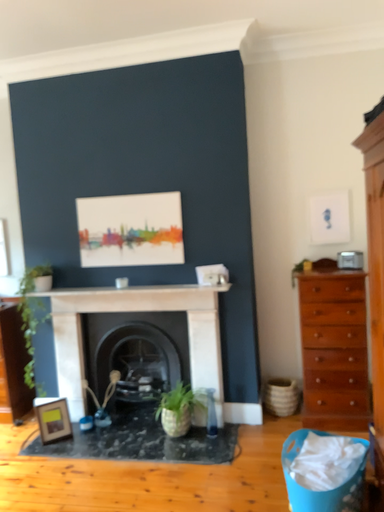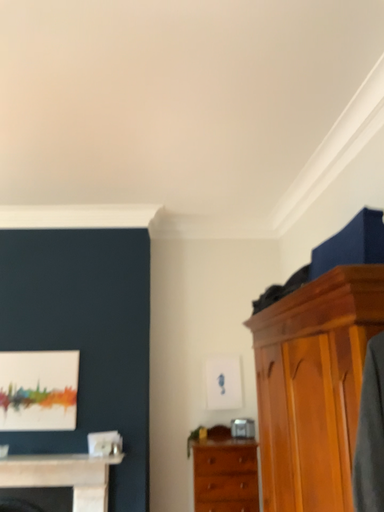
Question: Which way did the camera rotate in the video?

Choices:
 (A) rotated left
 (B) rotated right

Answer: (B)